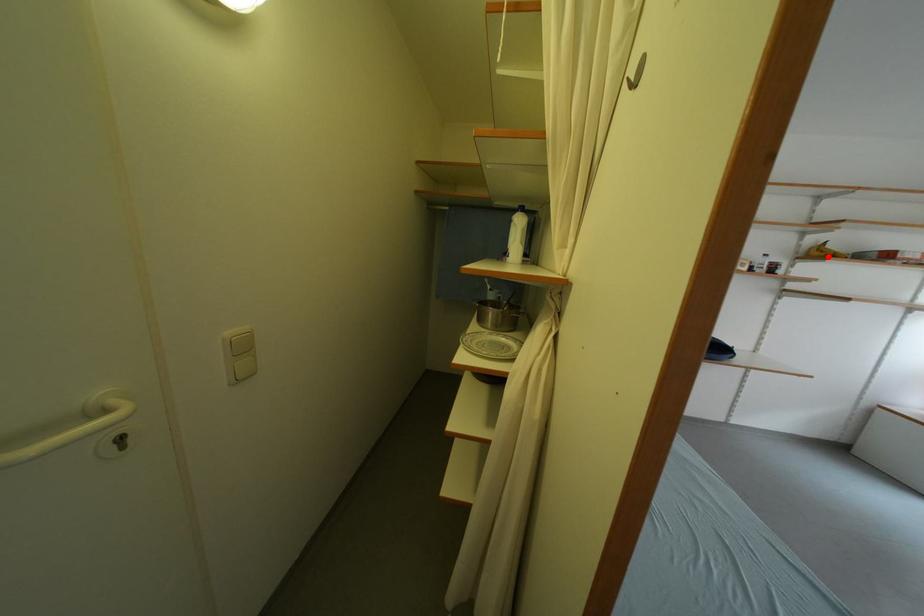
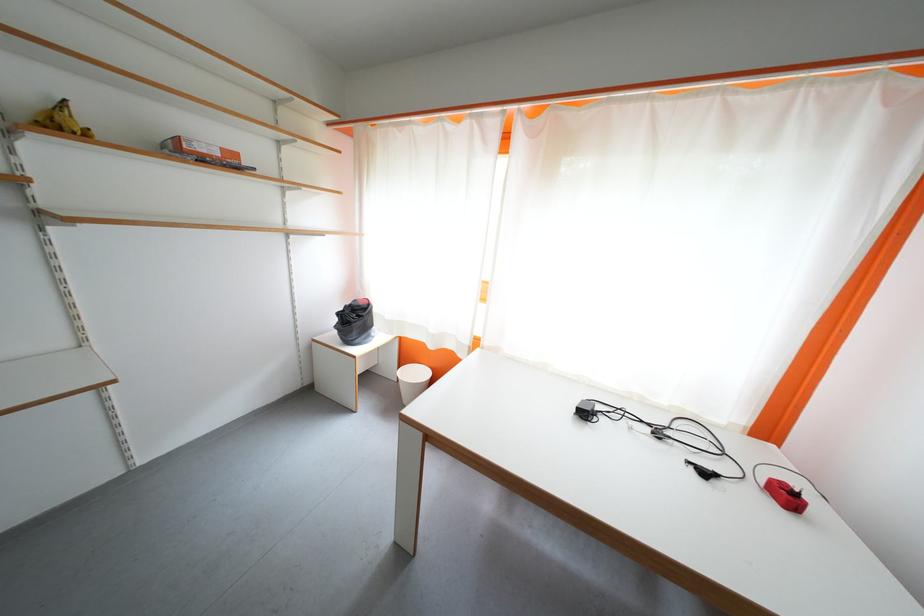
Where in the second image is the point corresponding to the highlighted location from the first image?

(68, 129)